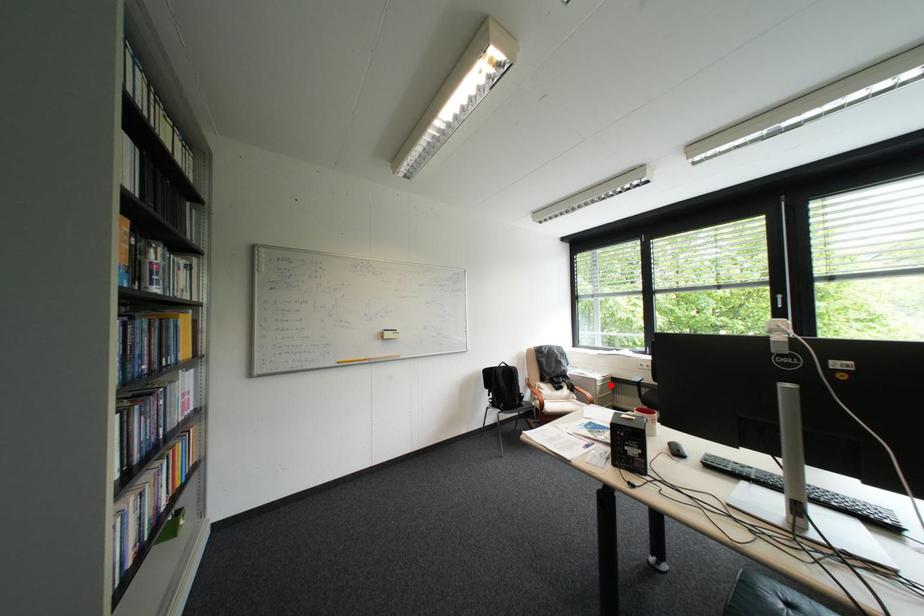
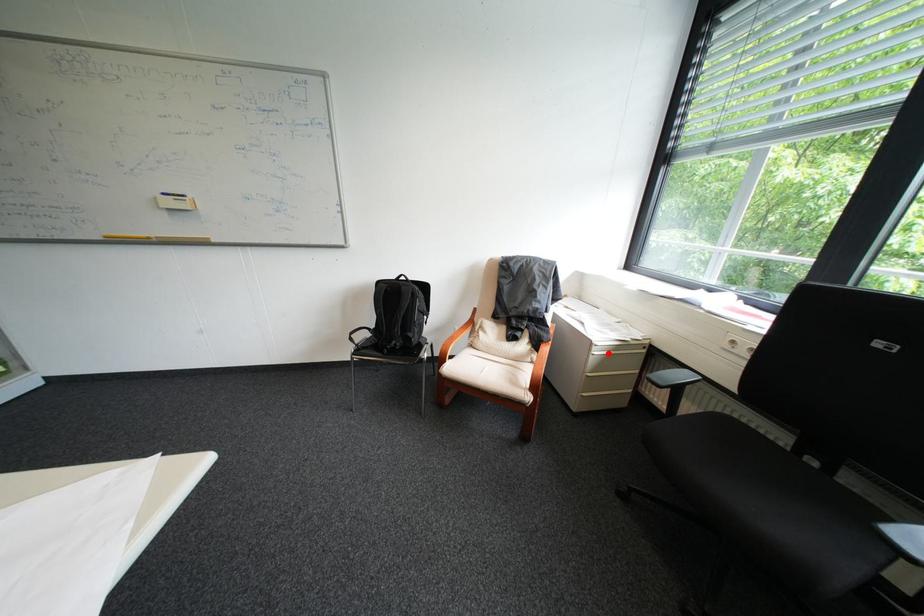
I am providing you with two images of the same scene from different viewpoints. A red point is marked on the first image and another point is marked on the second image. Does the point marked in image1 correspond to the same location as the one in image2?

Yes